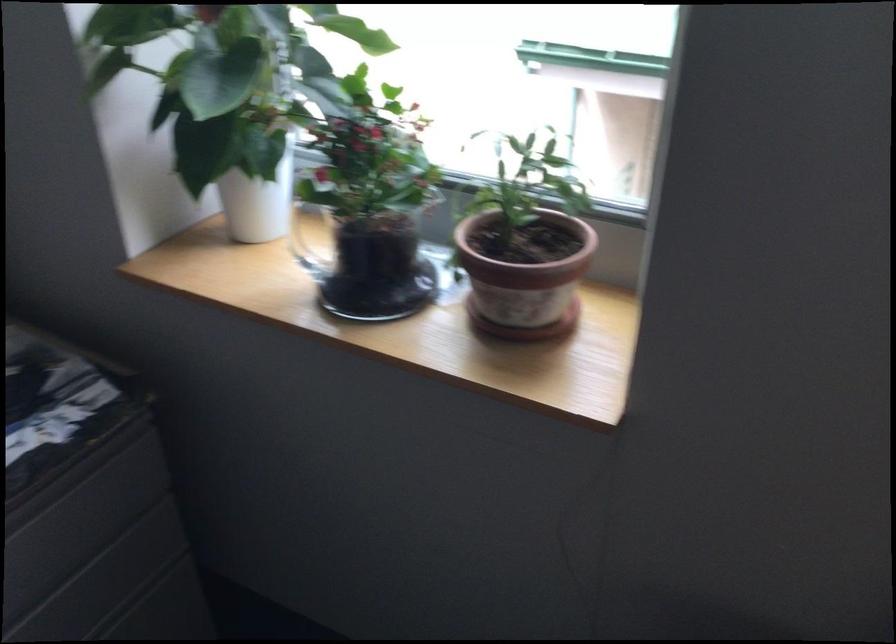
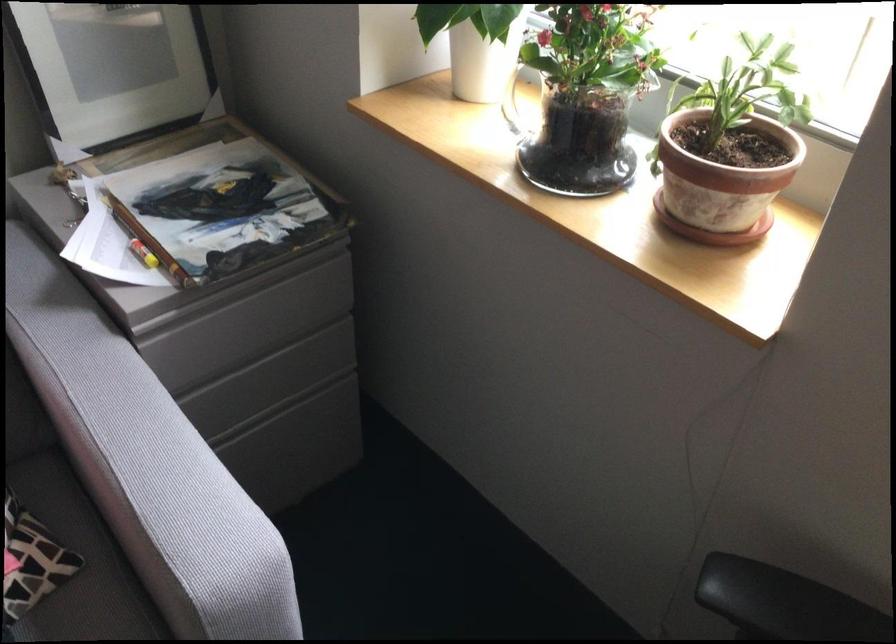
The point at (526, 281) is marked in the first image. Where is the corresponding point in the second image?

(721, 184)